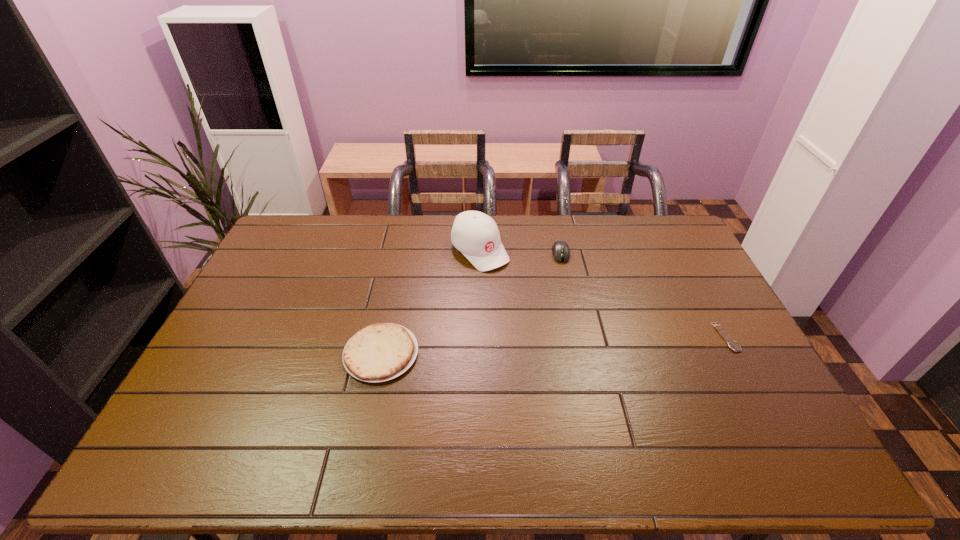
Where is `the leftmost object`? The height and width of the screenshot is (540, 960). the leftmost object is located at coordinates (379, 352).

Where is `the shortest object`? The width and height of the screenshot is (960, 540). the shortest object is located at coordinates (733, 345).

Where is `the rightmost object`? This screenshot has height=540, width=960. the rightmost object is located at coordinates (733, 345).

At what (x,y) coordinates should I click in order to perform the action: click on computer mouse. Please return your answer as a coordinate pair (x, y). Looking at the image, I should click on (560, 249).

Find the location of a particular element. The height and width of the screenshot is (540, 960). the second object from left to right is located at coordinates (475, 234).

I want to click on baseball cap, so click(475, 234).

The height and width of the screenshot is (540, 960). I want to click on vacant space located 0.280m on the back of the leftmost object, so click(399, 266).

Locate an element on the screen. This screenshot has height=540, width=960. vacant space located on the back of the rightmost object is located at coordinates (682, 254).

Where is `vacant space located 0.330m on the wheel side of the computer mouse`? The height and width of the screenshot is (540, 960). vacant space located 0.330m on the wheel side of the computer mouse is located at coordinates (574, 335).

Identify the location of free space located on the wheel side of the computer mouse. (566, 285).